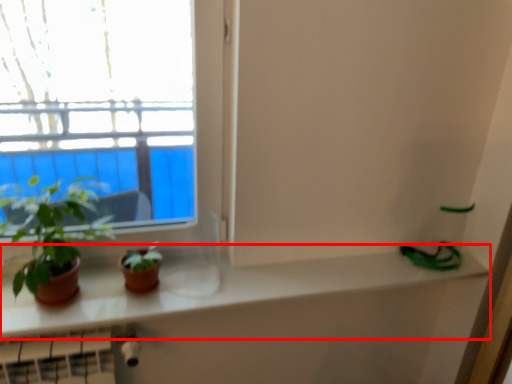
Question: From the image, what is the correct spatial relationship of counter top (annotated by the red box) in relation to houseplant?

Choices:
 (A) right
 (B) left

Answer: (A)